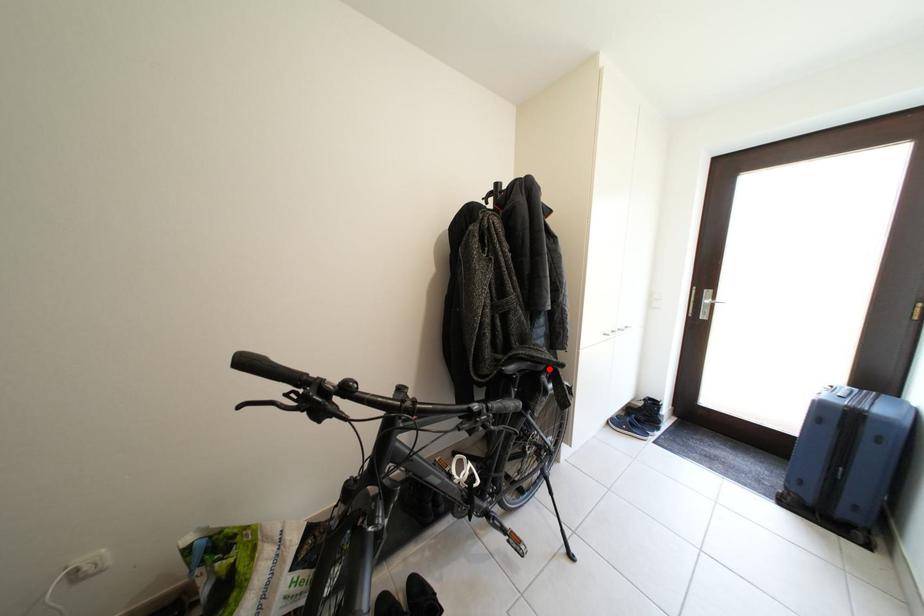
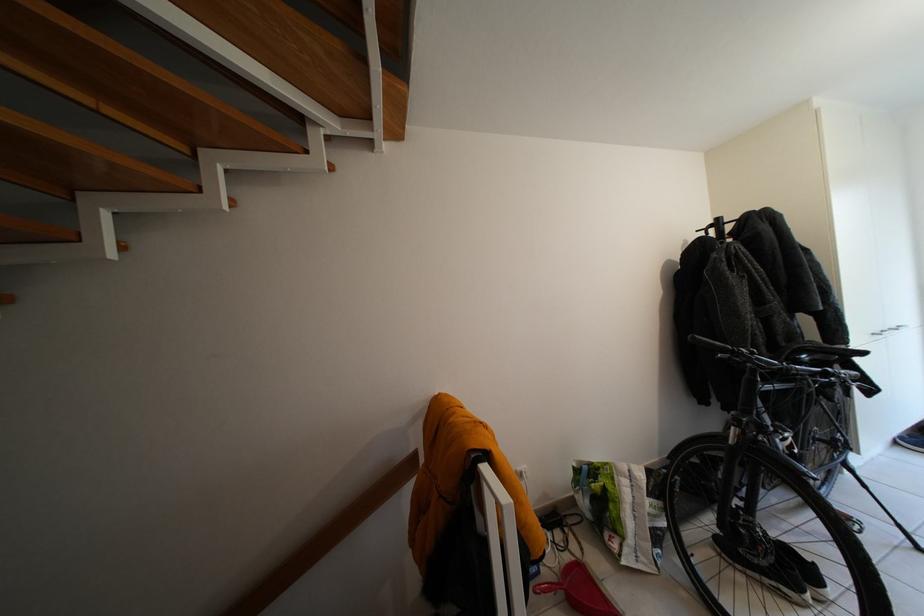
Question: I am providing you with two images of the same scene from different viewpoints. In image1, a red point is highlighted. Considering the same 3D point in image2, which of the following is correct?

Choices:
 (A) It is closer
 (B) It is farther

Answer: (A)